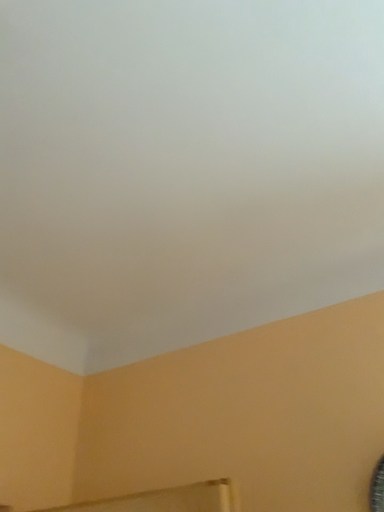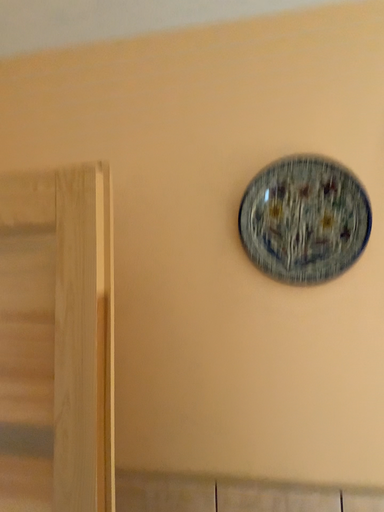
Question: Which way did the camera rotate in the video?

Choices:
 (A) rotated upward
 (B) rotated downward

Answer: (B)